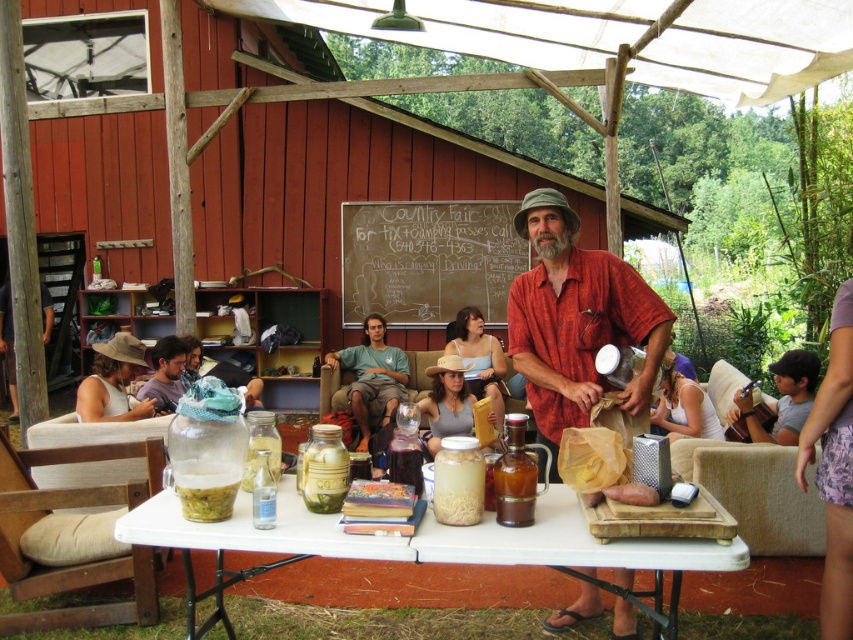
Is matte gray tank top at center to the left of wooden chair at left from the viewer's perspective?

In fact, matte gray tank top at center is to the right of wooden chair at left.

Does matte gray tank top at center have a lesser width compared to wooden chair at left?

Correct, matte gray tank top at center's width is less than wooden chair at left's.

At what (x,y) coordinates should I click in order to perform the action: click on matte gray tank top at center. Please return your answer as a coordinate pair (x, y). Looking at the image, I should click on (445, 403).

Where is `matte gray tank top at center`? This screenshot has height=640, width=853. matte gray tank top at center is located at coordinates (445, 403).

Which is behind, point (90, 406) or point (682, 408)?

Positioned behind is point (682, 408).

This screenshot has width=853, height=640. What do you see at coordinates (113, 381) in the screenshot?
I see `matte white tank top at lower left` at bounding box center [113, 381].

Locate an element on the screen. matte white tank top at lower left is located at coordinates (113, 381).

Does white plastic table at center have a greater width compared to clear glass bottle at center?

Yes.

Is white plastic table at center positioned behind clear glass bottle at center?

No, it is in front of clear glass bottle at center.

Is point (321, 540) closer to camera compared to point (254, 490)?

Yes.

In order to click on white plastic table at center in this screenshot , I will do `click(427, 538)`.